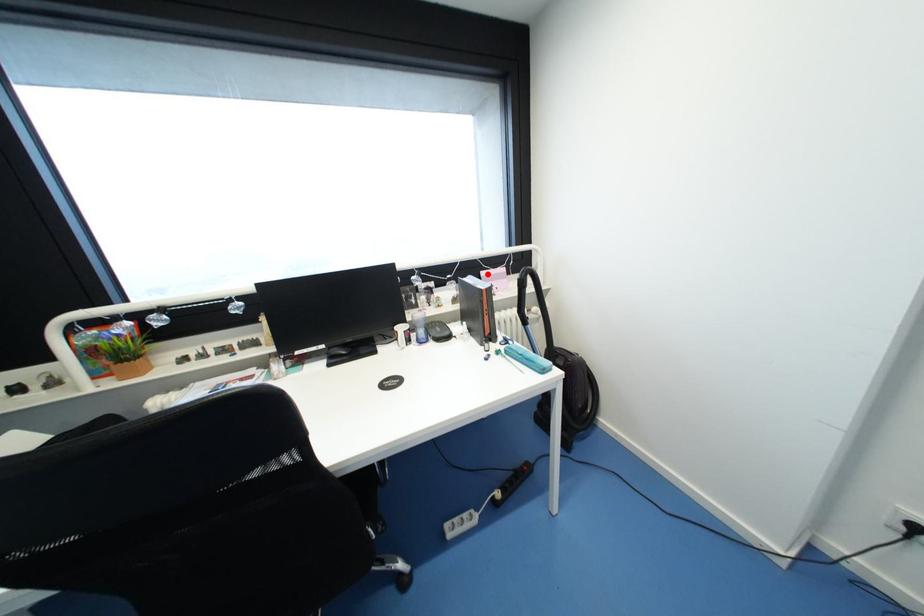
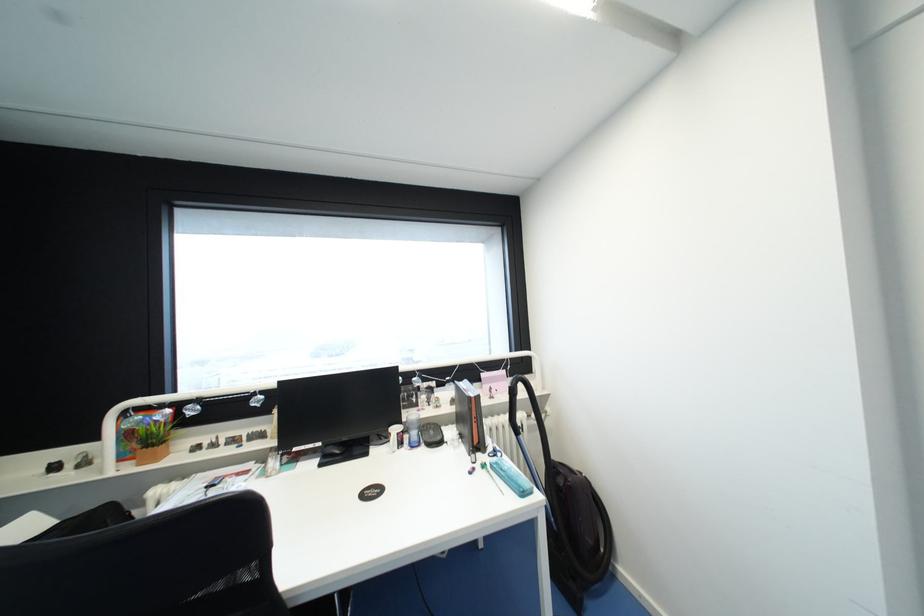
Locate, in the second image, the point that corresponds to the highlighted location in the first image.

(488, 376)